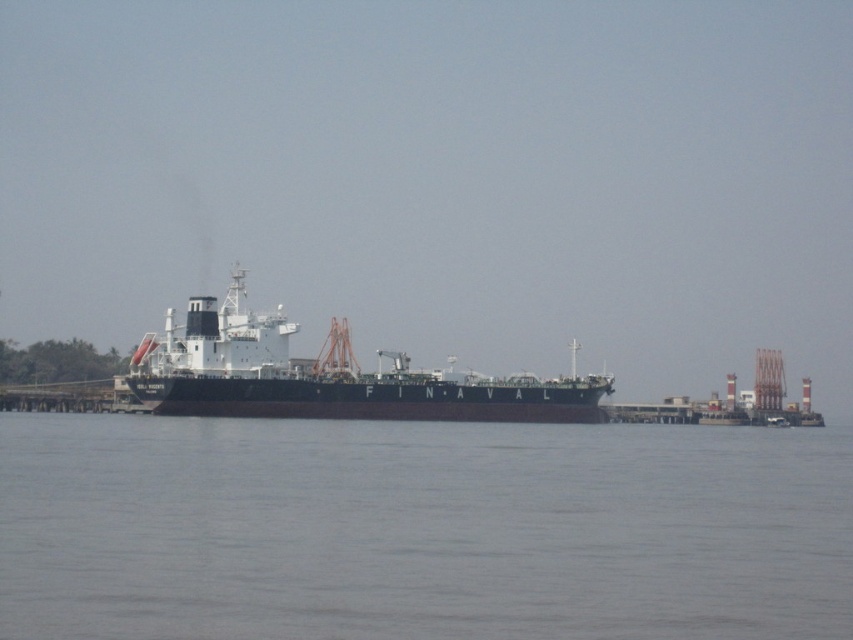
You are standing on the deck of the ship named FINAVAL and want to locate the gray water at center. According to the coordinates provided, where exactly would you find it?

The gray water at center is located at coordinates point (421, 529).